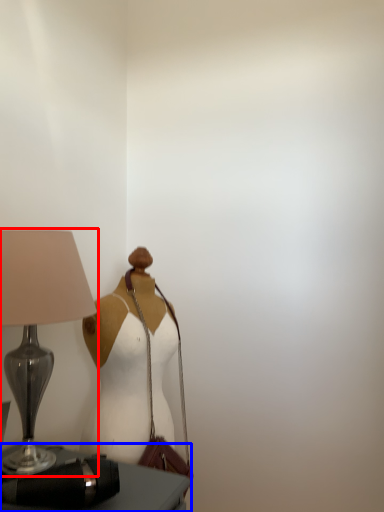
Question: Which object is closer to the camera taking this photo, lamp (highlighted by a red box) or furniture (highlighted by a blue box)?

Choices:
 (A) lamp
 (B) furniture

Answer: (B)